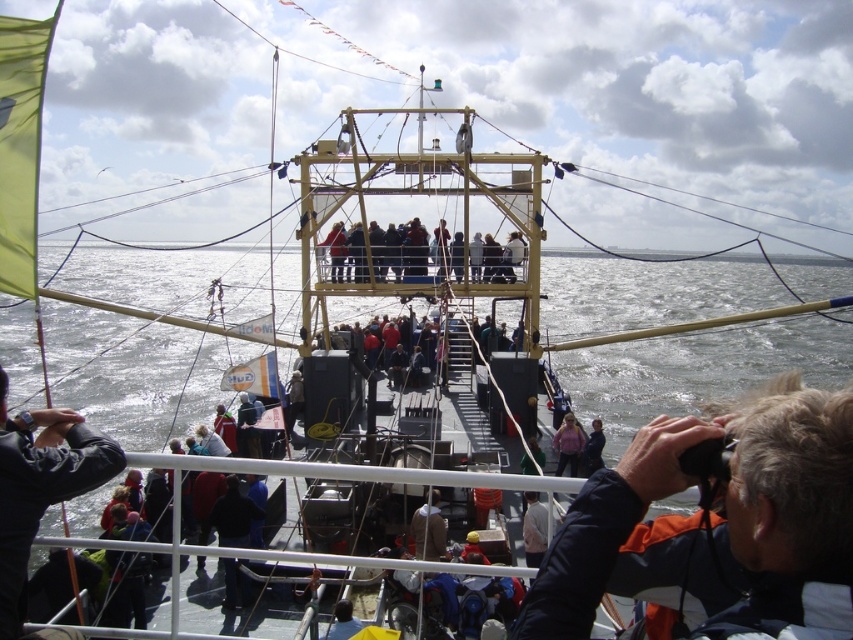
Question: Is dark blue jacket at lower right above black fabric camera at lower left?

Choices:
 (A) yes
 (B) no

Answer: (B)

Question: Which point is closer to the camera taking this photo?

Choices:
 (A) (746, 429)
 (B) (437, 548)
 (C) (45, 412)
 (D) (381, 262)

Answer: (A)

Question: Which of the following is the farthest from the observer?

Choices:
 (A) black fabric camera at lower left
 (B) light brown wooden deck at center
 (C) dark blue jacket at lower right
 (D) brown leather jacket at center

Answer: (B)

Question: Does dark blue jacket at lower right have a smaller size compared to black fabric camera at lower left?

Choices:
 (A) no
 (B) yes

Answer: (B)

Question: Which point is farther from the camera taking this photo?

Choices:
 (A) (44, 464)
 (B) (401, 241)
 (C) (840, 545)

Answer: (B)

Question: Does black fabric camera at lower left have a smaller size compared to brown leather jacket at center?

Choices:
 (A) yes
 (B) no

Answer: (B)